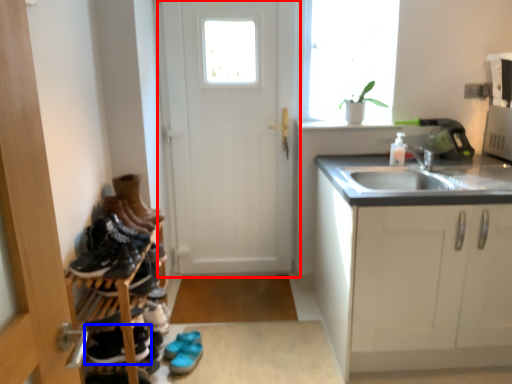
Question: Which point is closer to the camera, door (highlighted by a red box) or footwear (highlighted by a blue box)?

Choices:
 (A) door
 (B) footwear

Answer: (B)